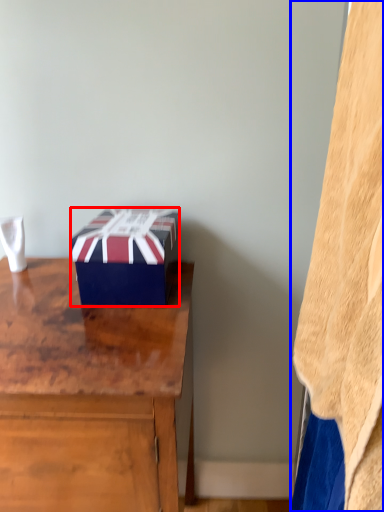
Question: Which of the following is the closest to the observer, box (highlighted by a red box) or blanket (highlighted by a blue box)?

Choices:
 (A) box
 (B) blanket

Answer: (B)